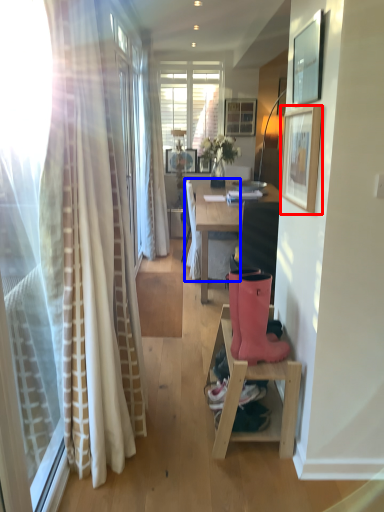
Question: Among these objects, which one is nearest to the camera, picture frame (highlighted by a red box) or chair (highlighted by a blue box)?

Choices:
 (A) picture frame
 (B) chair

Answer: (A)